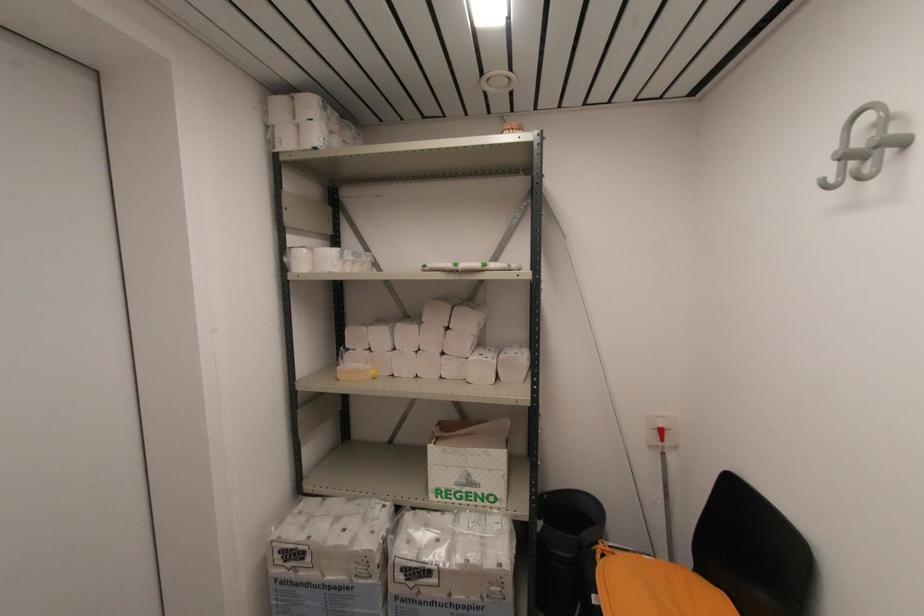
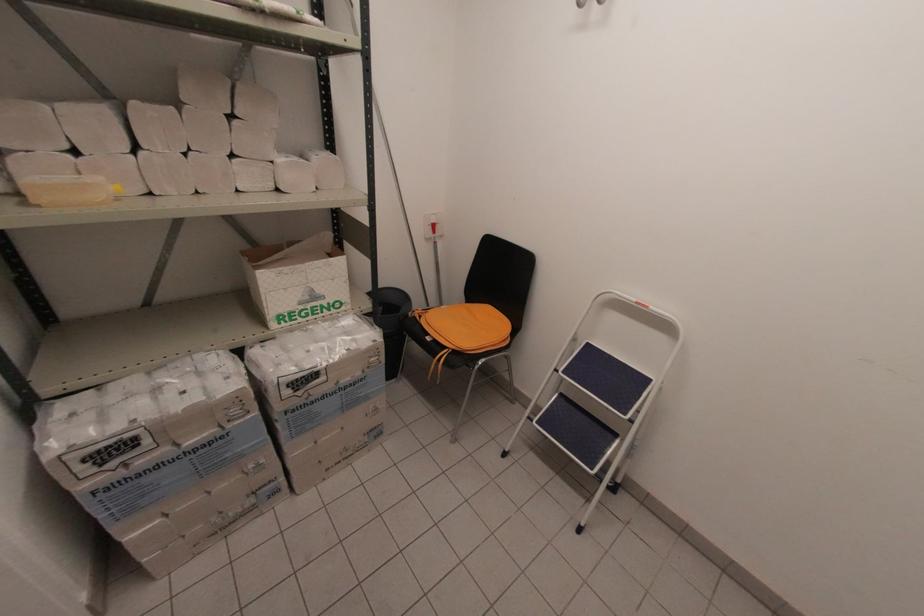
The point at (373, 373) is marked in the first image. Where is the corresponding point in the second image?

(116, 188)